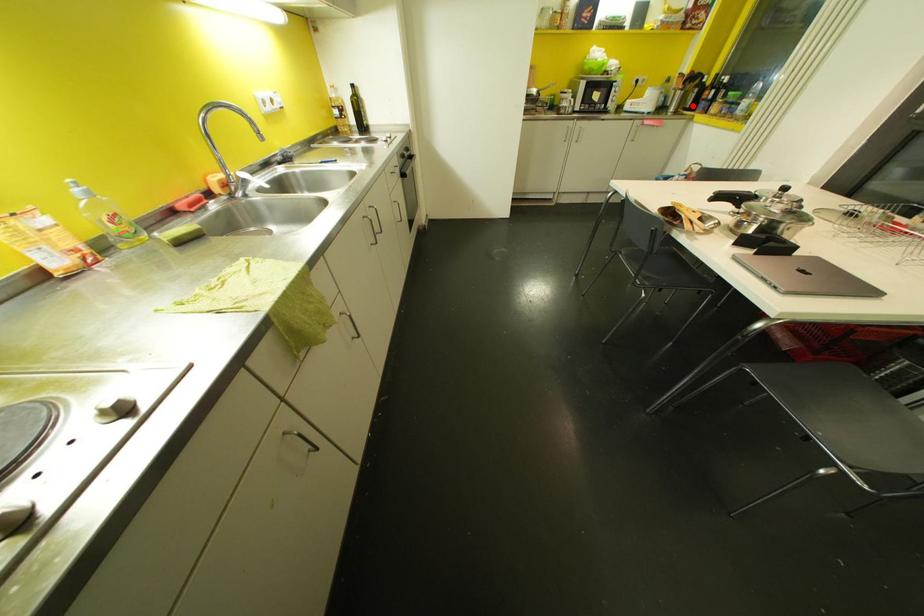
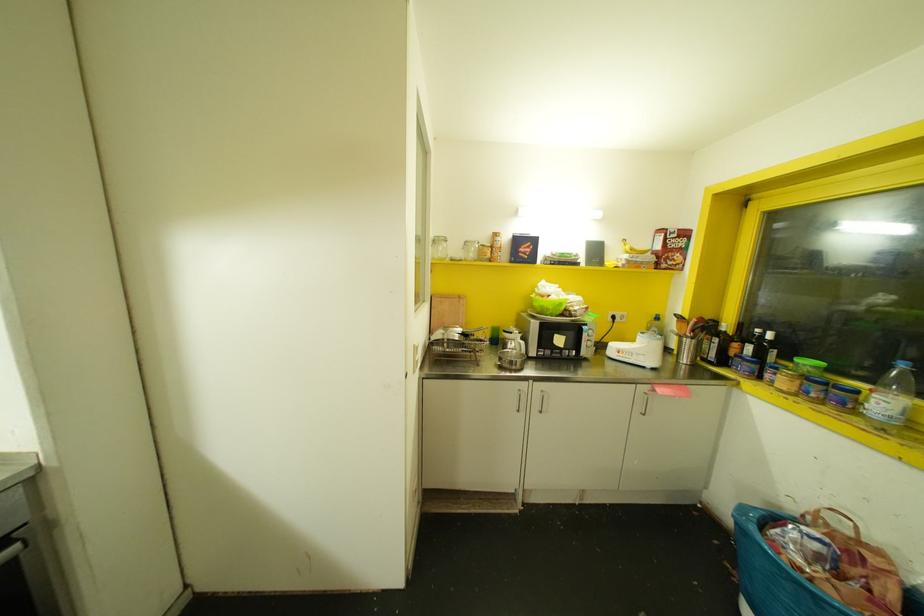
Where in the second image is the point corresponding to the highlighted location from the first image?

(723, 361)